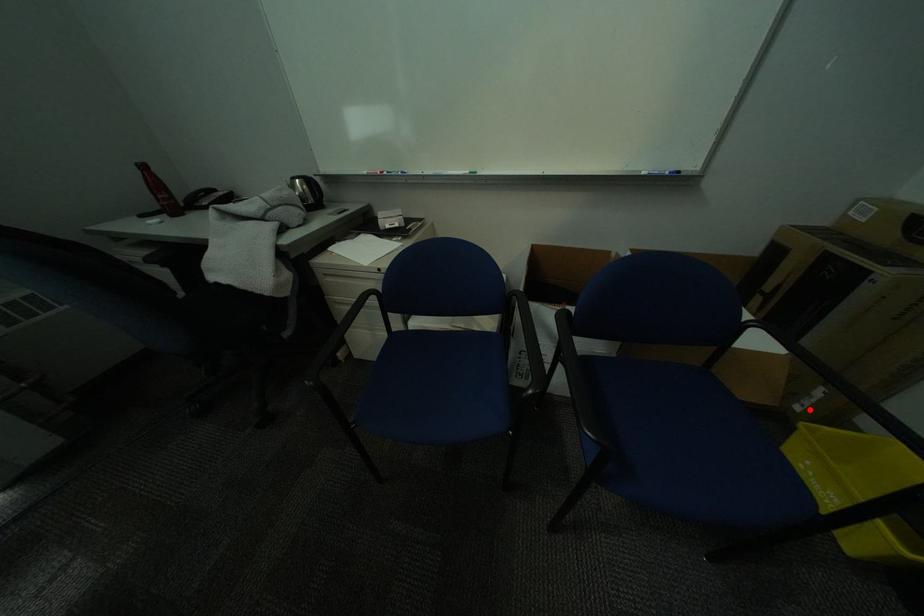
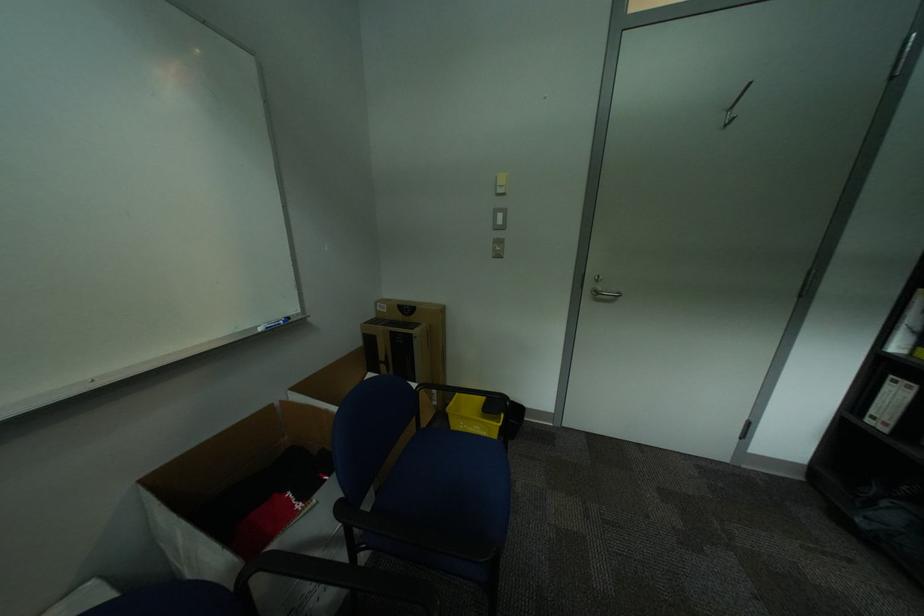
In the second image, find the point that corresponds to the highlighted location in the first image.

(445, 403)